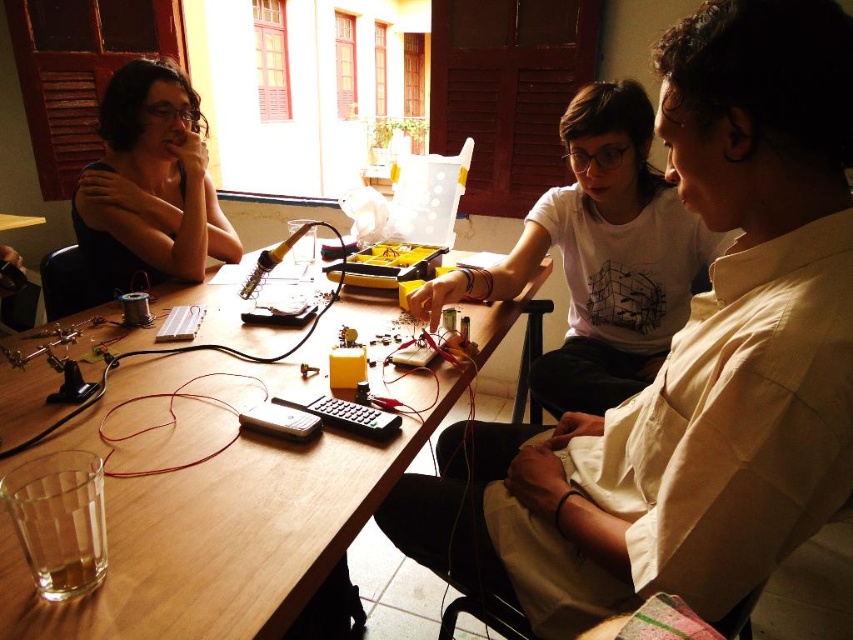
Which is above, wooden table at center or matte black shirt at left?

matte black shirt at left is higher up.

Can you confirm if wooden table at center is positioned above matte black shirt at left?

Incorrect, wooden table at center is not positioned above matte black shirt at left.

This screenshot has height=640, width=853. Identify the location of wooden table at center. (242, 522).

Is point (560, 602) positioned in front of point (138, 147)?

Yes, point (560, 602) is closer to viewer.

Locate an element on the screen. The image size is (853, 640). white matte shirt at upper center is located at coordinates (688, 364).

Does wooden table at center have a smaller size compared to white cotton shirt at center?

No, wooden table at center is not smaller than white cotton shirt at center.

Does point (323, 493) lie behind point (556, 196)?

That is False.

This screenshot has width=853, height=640. What are the coordinates of `wooden table at center` in the screenshot? It's located at (242, 522).